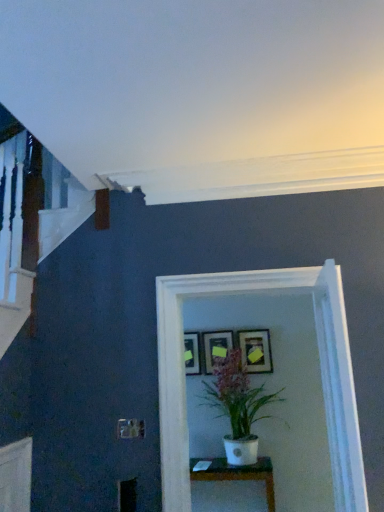
Question: Could you tell me if white glossy glass door at center is facing matte gold picture frame at center, which is counted as the first picture frame, starting from the right?

Choices:
 (A) no
 (B) yes

Answer: (A)

Question: Is white glossy glass door at center thinner than matte gold picture frame at center, which is counted as the first picture frame, starting from the right?

Choices:
 (A) no
 (B) yes

Answer: (A)

Question: Is matte gold picture frame at center, which is counted as the first picture frame, starting from the right, at the back of white glossy glass door at center?

Choices:
 (A) no
 (B) yes

Answer: (B)

Question: From the image's perspective, would you say white glossy glass door at center is positioned over matte gold picture frame at center, which is counted as the first picture frame, starting from the right?

Choices:
 (A) no
 (B) yes

Answer: (B)

Question: Is white glossy glass door at center positioned far away from matte gold picture frame at center, which is the 3th picture frame from left to right?

Choices:
 (A) yes
 (B) no

Answer: (A)

Question: Is white matte pot at center in front of or behind matte black picture frame at center, placed as the 3th picture frame when sorted from right to left, in the image?

Choices:
 (A) behind
 (B) front

Answer: (B)

Question: From the image's perspective, is white matte pot at center positioned above or below matte black picture frame at center, placed as the 3th picture frame when sorted from right to left?

Choices:
 (A) below
 (B) above

Answer: (A)

Question: Is white matte pot at center taller or shorter than matte black picture frame at center, placed as the 3th picture frame when sorted from right to left?

Choices:
 (A) tall
 (B) short

Answer: (A)

Question: Considering the positions of white matte pot at center and matte black picture frame at center, the 1th picture frame viewed from the left, in the image, is white matte pot at center wider or thinner than matte black picture frame at center, the 1th picture frame viewed from the left,?

Choices:
 (A) wide
 (B) thin

Answer: (A)

Question: Based on their sizes in the image, would you say matte black picture frame at center, which is counted as the second picture frame, starting from the right, is bigger or smaller than white glossy table at center?

Choices:
 (A) small
 (B) big

Answer: (A)

Question: Considering their positions, is matte black picture frame at center, the second picture frame when ordered from left to right, located in front of or behind white glossy table at center?

Choices:
 (A) behind
 (B) front

Answer: (A)

Question: Does point (215, 344) appear closer or farther from the camera than point (273, 494)?

Choices:
 (A) closer
 (B) farther

Answer: (B)

Question: Considering the relative positions of matte black picture frame at center, the second picture frame when ordered from left to right, and white glossy table at center in the image provided, is matte black picture frame at center, the second picture frame when ordered from left to right, to the left or to the right of white glossy table at center?

Choices:
 (A) left
 (B) right

Answer: (A)

Question: From the image's perspective, relative to matte gold picture frame at center, which is counted as the first picture frame, starting from the right, is matte black picture frame at center, the 1th picture frame viewed from the left, above or below?

Choices:
 (A) below
 (B) above

Answer: (A)

Question: In the image, is matte black picture frame at center, the 1th picture frame viewed from the left, on the left side or the right side of matte gold picture frame at center, which is counted as the first picture frame, starting from the right?

Choices:
 (A) left
 (B) right

Answer: (A)